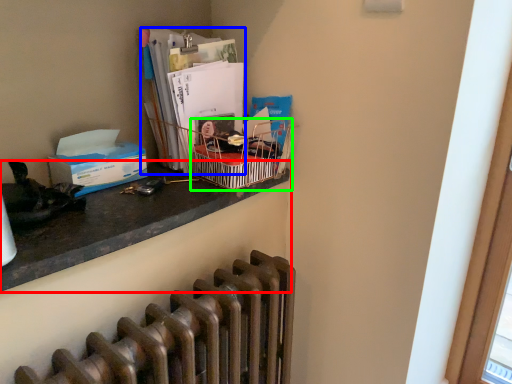
Question: Which object is positioned farthest from desk (highlighted by a red box)? Select from magazine (highlighted by a blue box) and crate (highlighted by a green box).

Choices:
 (A) magazine
 (B) crate

Answer: (A)